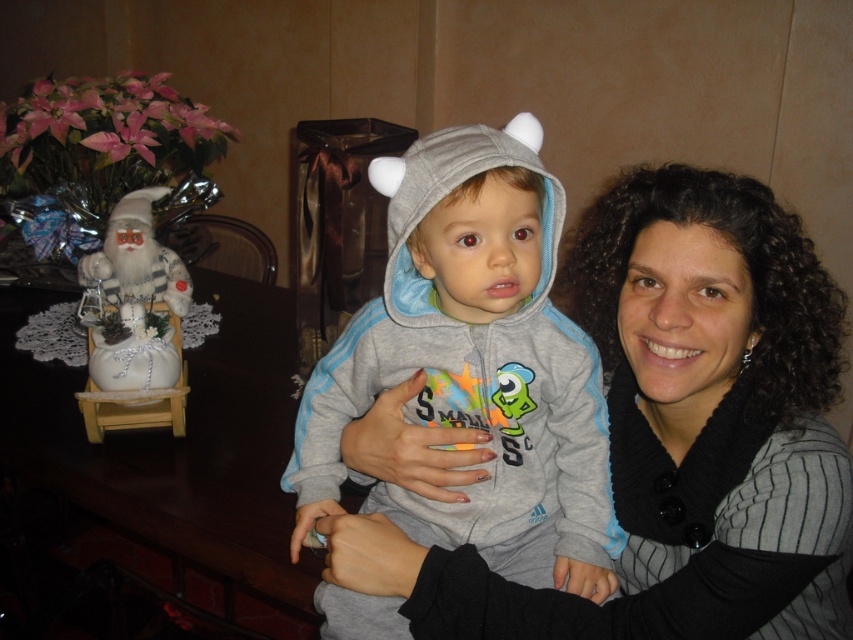
Can you confirm if gray fleece hoodie at center is shorter than white fabric santa at left?

No, gray fleece hoodie at center is not shorter than white fabric santa at left.

Consider the image. Who is taller, gray fleece hoodie at center or white fabric santa at left?

With more height is gray fleece hoodie at center.

Where is `gray fleece hoodie at center`? This screenshot has height=640, width=853. gray fleece hoodie at center is located at coordinates (474, 362).